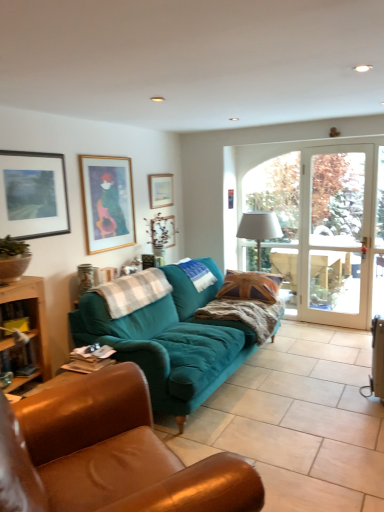
Question: From the image's perspective, is gold-framed picture at upper left, marked as the 3th picture frame in a right-to-left arrangement, beneath matte black picture frame at upper left, the first picture frame viewed from the left?

Choices:
 (A) no
 (B) yes

Answer: (A)

Question: Is gold-framed picture at upper left, acting as the second picture frame starting from the left, thinner than matte black picture frame at upper left, which is the first picture frame in front-to-back order?

Choices:
 (A) no
 (B) yes

Answer: (A)

Question: Is gold-framed picture at upper left, acting as the second picture frame starting from the left, bigger than matte black picture frame at upper left, which appears as the fourth picture frame when viewed from the back?

Choices:
 (A) yes
 (B) no

Answer: (A)

Question: Can you confirm if gold-framed picture at upper left, the third picture frame when ordered from back to front, is positioned to the left of matte black picture frame at upper left, which appears as the fourth picture frame when viewed from the back?

Choices:
 (A) yes
 (B) no

Answer: (B)

Question: Is gold-framed picture at upper left, acting as the second picture frame starting from the left, completely or partially outside of matte black picture frame at upper left, the first picture frame viewed from the left?

Choices:
 (A) yes
 (B) no

Answer: (A)

Question: Is gold-framed picture at upper left, acting as the second picture frame starting from the left, looking in the opposite direction of matte black picture frame at upper left, which appears as the fourth picture frame when viewed from the back?

Choices:
 (A) yes
 (B) no

Answer: (B)

Question: From a real-world perspective, does teal fabric couch at center, the 2th studio couch in the back-to-front sequence, sit lower than gold-framed picture at upper left, the 2th picture frame when ordered from front to back?

Choices:
 (A) no
 (B) yes

Answer: (B)

Question: Is teal fabric couch at center, positioned as the first studio couch in front-to-back order, further to camera compared to gold-framed picture at upper left, the 2th picture frame when ordered from front to back?

Choices:
 (A) yes
 (B) no

Answer: (B)

Question: Is teal fabric couch at center, positioned as the first studio couch in front-to-back order, facing towards gold-framed picture at upper left, the 2th picture frame when ordered from front to back?

Choices:
 (A) no
 (B) yes

Answer: (A)

Question: From the image's perspective, is teal fabric couch at center, positioned as the first studio couch in front-to-back order, located above gold-framed picture at upper left, marked as the 3th picture frame in a right-to-left arrangement?

Choices:
 (A) yes
 (B) no

Answer: (B)

Question: Is teal fabric couch at center, positioned as the first studio couch in front-to-back order, located outside gold-framed picture at upper left, the third picture frame when ordered from back to front?

Choices:
 (A) no
 (B) yes

Answer: (B)

Question: Does teal fabric couch at center, positioned as the first studio couch in front-to-back order, have a greater height compared to gold-framed picture at upper left, acting as the second picture frame starting from the left?

Choices:
 (A) no
 (B) yes

Answer: (B)

Question: Considering the relative positions of wooden picture frame at upper center, positioned as the second picture frame in right-to-left order, and matte black picture frame at upper left, the first picture frame viewed from the left, in the image provided, is wooden picture frame at upper center, positioned as the second picture frame in right-to-left order, to the right of matte black picture frame at upper left, the first picture frame viewed from the left, from the viewer's perspective?

Choices:
 (A) yes
 (B) no

Answer: (A)